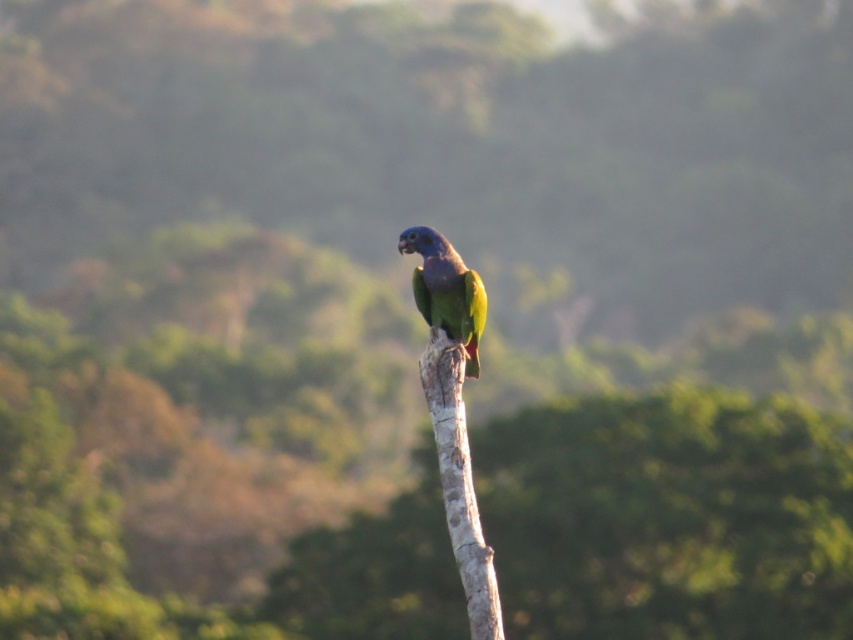
You are a photographer aiming to capture the parrot on the smooth bark tree branch at center. To ensure the branch is in the center of your photo, where should you position your camera focus? Please provide coordinates based on the image grid system where the bottom left corner is the origin point.

The smooth bark tree branch at center is located at coordinates point (459, 483), so you should position your camera focus at that point to center the branch in your photo.